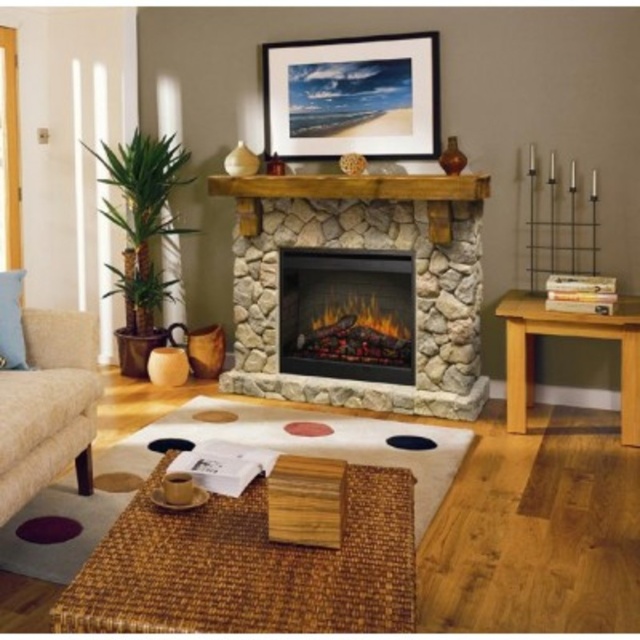
You are standing in the living room and want to hang a new picture frame. You notice a point at coordinates (x=353, y=97). What object is this point located on?

The point at coordinates (x=353, y=97) is on the matte black picture frame at upper center.

You are arranging flowers in the living room and need to place a vase on a surface. You have a choice between the natural stone fireplace at center and the light brown wooden table at right. Which surface is to the right of the other?

The natural stone fireplace at center is positioned on the left side of the light brown wooden table at right, so the light brown wooden table at right is to the right of the natural stone fireplace at center.

You are standing in the living room and want to walk from the light brown wooden table at right to the natural stone fireplace at center. Which direction should you move towards?

You should move towards the natural stone fireplace at center because it is closer to you than the light brown wooden table at right.